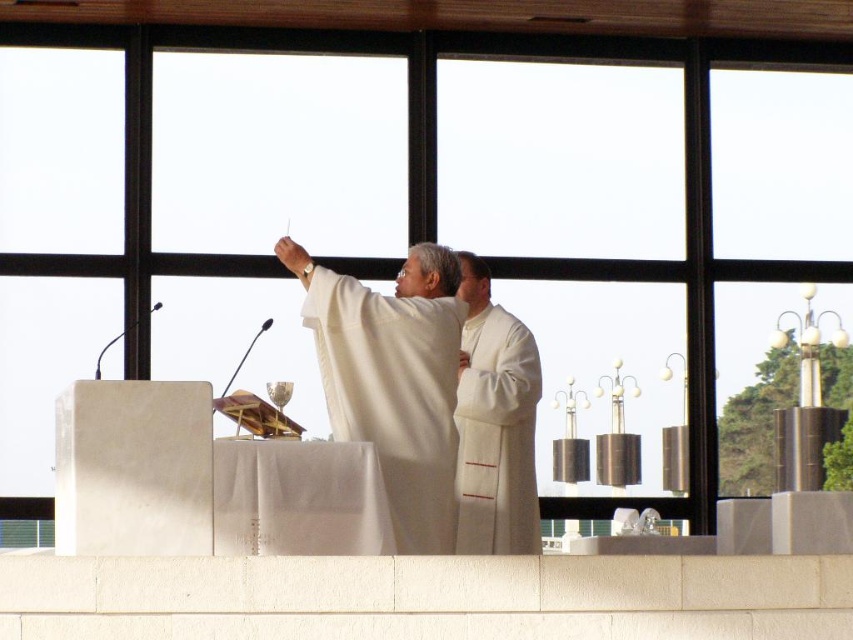
Question: Which of the following is the farthest from the observer?

Choices:
 (A) white silk robe at center
 (B) white matte robe at center

Answer: (A)

Question: Is white matte robe at center positioned behind white silk robe at center?

Choices:
 (A) no
 (B) yes

Answer: (A)

Question: Does white matte robe at center appear on the right side of white silk robe at center?

Choices:
 (A) yes
 (B) no

Answer: (B)

Question: Among these objects, which one is nearest to the camera?

Choices:
 (A) white silk robe at center
 (B) white matte robe at center

Answer: (B)

Question: Which point is farther from the camera taking this photo?

Choices:
 (A) (463, 540)
 (B) (434, 401)

Answer: (A)

Question: Does white matte robe at center appear over white silk robe at center?

Choices:
 (A) no
 (B) yes

Answer: (B)